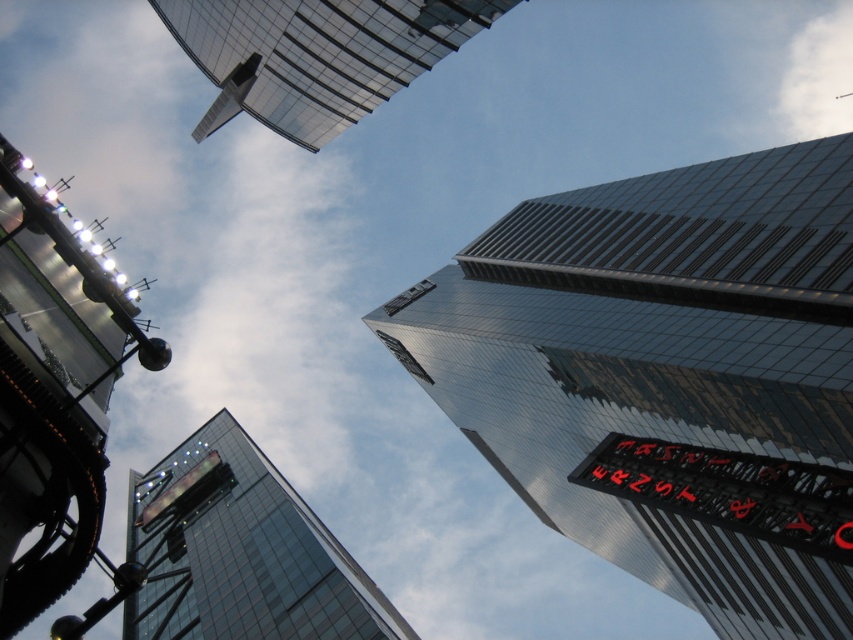
Question: Is shiny glass skyscraper at upper right wider than transparent glass tower at upper center?

Choices:
 (A) yes
 (B) no

Answer: (A)

Question: Which of the following is the farthest from the observer?

Choices:
 (A) red led sign at right
 (B) shiny glass skyscraper at upper right
 (C) transparent glass tower at upper center

Answer: (C)

Question: Among these objects, which one is nearest to the camera?

Choices:
 (A) transparent glass tower at center
 (B) red led sign at right
 (C) metallic glass tower at upper left
 (D) transparent glass tower at upper center

Answer: (C)

Question: Does shiny glass skyscraper at upper right have a greater width compared to transparent glass tower at center?

Choices:
 (A) no
 (B) yes

Answer: (A)

Question: Which point is farther to the camera?

Choices:
 (A) red led sign at right
 (B) metallic glass tower at upper left
 (C) transparent glass tower at upper center
 (D) shiny glass skyscraper at upper right

Answer: (C)

Question: Does metallic glass tower at upper left appear on the left side of red led sign at right?

Choices:
 (A) no
 (B) yes

Answer: (B)